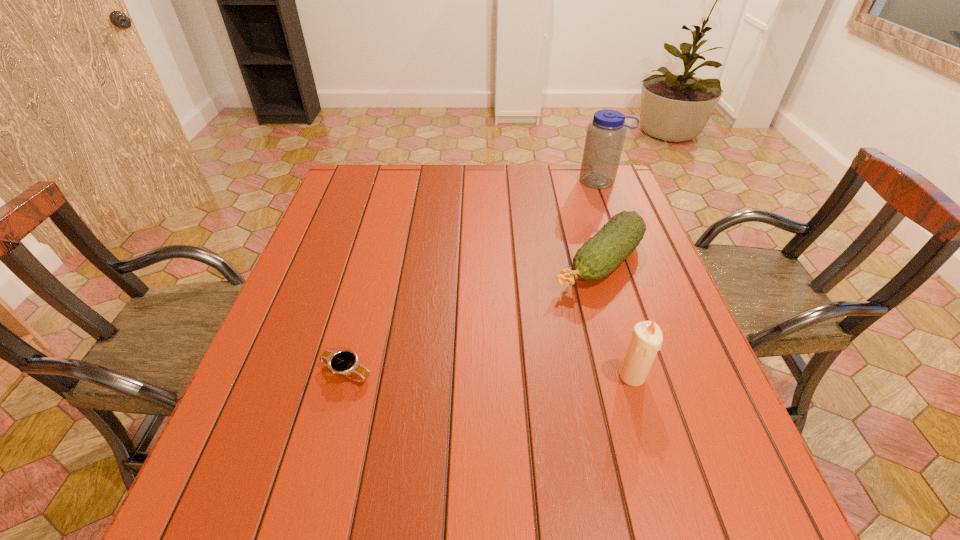
Identify the location of free space located with a carrying loop on the side of the tallest object. The image size is (960, 540). (564, 231).

The width and height of the screenshot is (960, 540). What are the coordinates of `vacant space located with a carrying loop on the side of the tallest object` in the screenshot? It's located at (557, 241).

At what (x,y) coordinates should I click in order to perform the action: click on vacant region located at the blossom end of the second farthest object. Please return your answer as a coordinate pair (x, y). Looking at the image, I should click on (531, 321).

You are a GUI agent. You are given a task and a screenshot of the screen. Output one action in this format:
    pyautogui.click(x=<x>, y=<y>)
    Task: Click on the vacant area situated at the blossom end of the second farthest object
    
    Given the screenshot: What is the action you would take?
    pyautogui.click(x=517, y=334)

Find the location of `vacant point located 0.270m at the blossom end of the second farthest object`. vacant point located 0.270m at the blossom end of the second farthest object is located at coordinates click(x=496, y=353).

Identify the location of object that is at the far edge. Image resolution: width=960 pixels, height=540 pixels. (605, 136).

Where is `object that is at the left edge`? object that is at the left edge is located at coordinates (344, 362).

Image resolution: width=960 pixels, height=540 pixels. In order to click on candle located at the right edge in this screenshot , I will do `click(646, 341)`.

You are a GUI agent. You are given a task and a screenshot of the screen. Output one action in this format:
    pyautogui.click(x=<x>, y=<y>)
    Task: Click on the water bottle that is at the right edge
    The width and height of the screenshot is (960, 540).
    Given the screenshot: What is the action you would take?
    pyautogui.click(x=605, y=136)

You are a GUI agent. You are given a task and a screenshot of the screen. Output one action in this format:
    pyautogui.click(x=<x>, y=<y>)
    Task: Click on the cucumber that is at the right edge
    The image size is (960, 540).
    Given the screenshot: What is the action you would take?
    pyautogui.click(x=599, y=256)